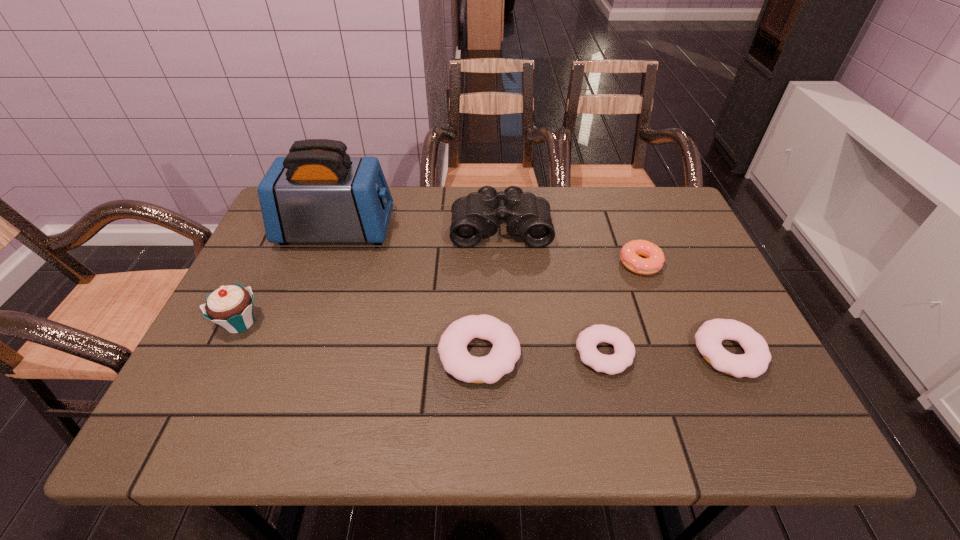
Find the location of a particular element. This screenshot has width=960, height=540. vacant space located 0.170m on the back of the second shortest object is located at coordinates (691, 274).

At what (x,y) coordinates should I click in order to perform the action: click on vacant area situated on the front-facing side of the toaster. Please return your answer as a coordinate pair (x, y). Looking at the image, I should click on click(534, 231).

In order to click on vacant space located 0.200m on the front of the farthest doughnut in this screenshot , I will do `click(669, 342)`.

Find the location of `free region located at the eyepieces of the binoculars`. free region located at the eyepieces of the binoculars is located at coordinates (503, 283).

Find the location of a particular element. This screenshot has height=540, width=960. vacant space located 0.230m on the right of the cupcake is located at coordinates (364, 323).

The height and width of the screenshot is (540, 960). I want to click on toaster situated at the far edge, so (317, 193).

Identify the location of binoculars that is at the far edge. (475, 216).

Image resolution: width=960 pixels, height=540 pixels. I want to click on toaster present at the left edge, so click(x=317, y=193).

Where is `cupcake situated at the left edge`? The image size is (960, 540). cupcake situated at the left edge is located at coordinates (231, 307).

Locate an element on the screen. The height and width of the screenshot is (540, 960). object that is positioned at the far left corner is located at coordinates (317, 193).